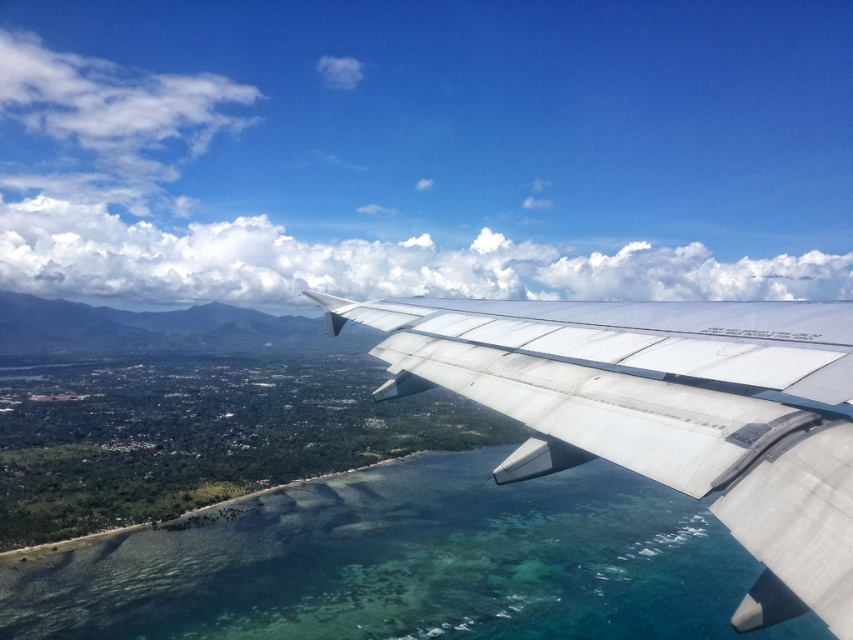
Question: Is clear blue water at lower center to the left of silver metallic wing at center from the viewer's perspective?

Choices:
 (A) yes
 (B) no

Answer: (B)

Question: Can you confirm if clear blue water at lower center is bigger than silver metallic wing at center?

Choices:
 (A) no
 (B) yes

Answer: (B)

Question: Which point appears farthest from the camera in this image?

Choices:
 (A) (132, 561)
 (B) (718, 438)

Answer: (A)

Question: Does clear blue water at lower center lie behind silver metallic wing at center?

Choices:
 (A) no
 (B) yes

Answer: (B)

Question: Which point is farther to the camera?

Choices:
 (A) silver metallic wing at center
 (B) clear blue water at lower center

Answer: (B)

Question: Which of the following is the closest to the observer?

Choices:
 (A) clear blue water at lower center
 (B) silver metallic wing at center

Answer: (B)